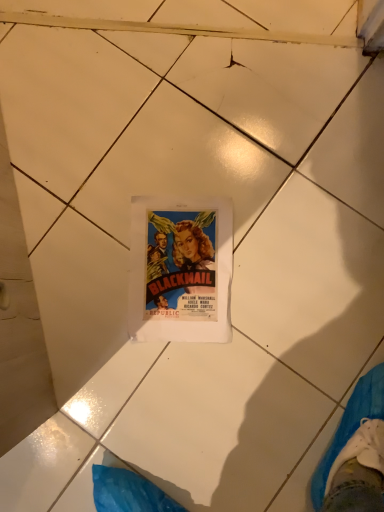
Where is `empty space that is ontop of matte paper poster at center`? This screenshot has height=512, width=384. empty space that is ontop of matte paper poster at center is located at coordinates (180, 269).